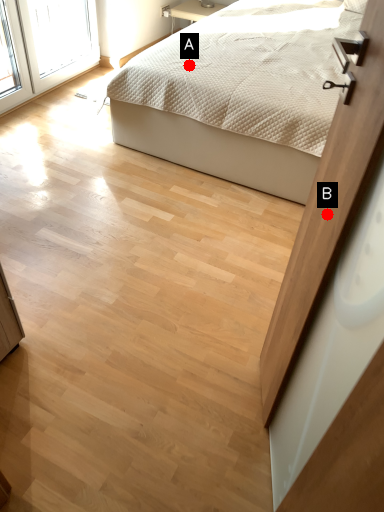
Question: Two points are circled on the image, labeled by A and B beside each circle. Which point is farther from the camera taking this photo?

Choices:
 (A) A is further
 (B) B is further

Answer: (A)